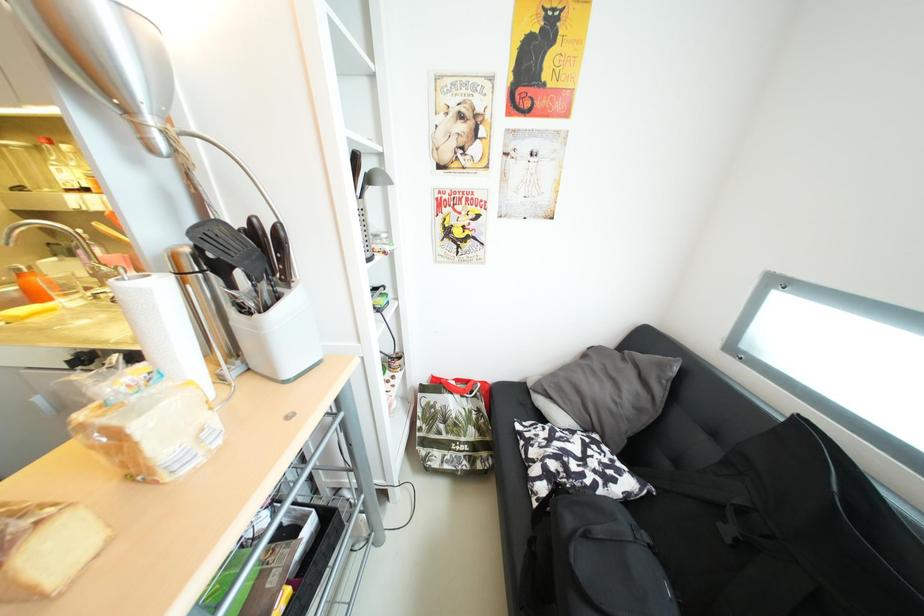
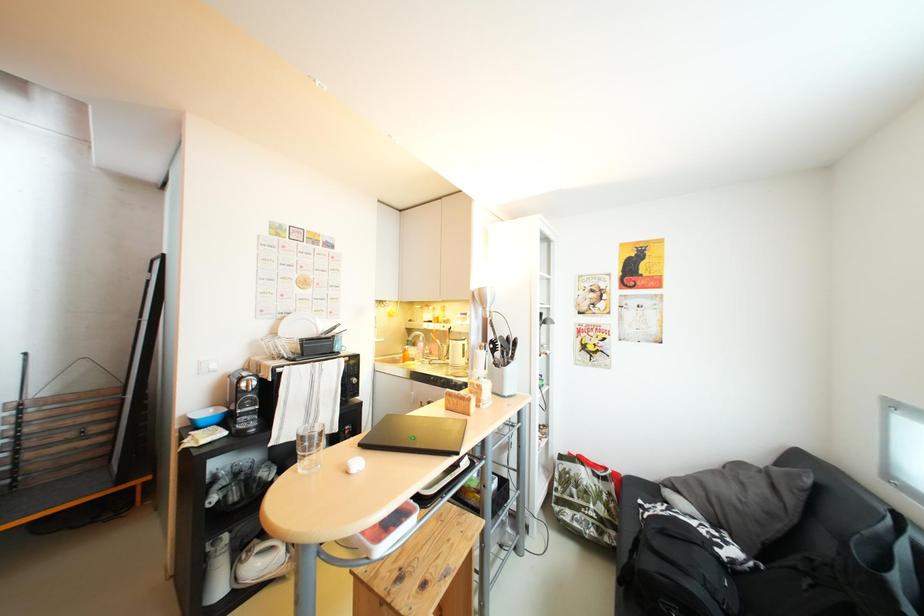
The first image is from the beginning of the video and the second image is from the end. How did the camera likely rotate when shooting the video?

The camera rotated toward left-up.